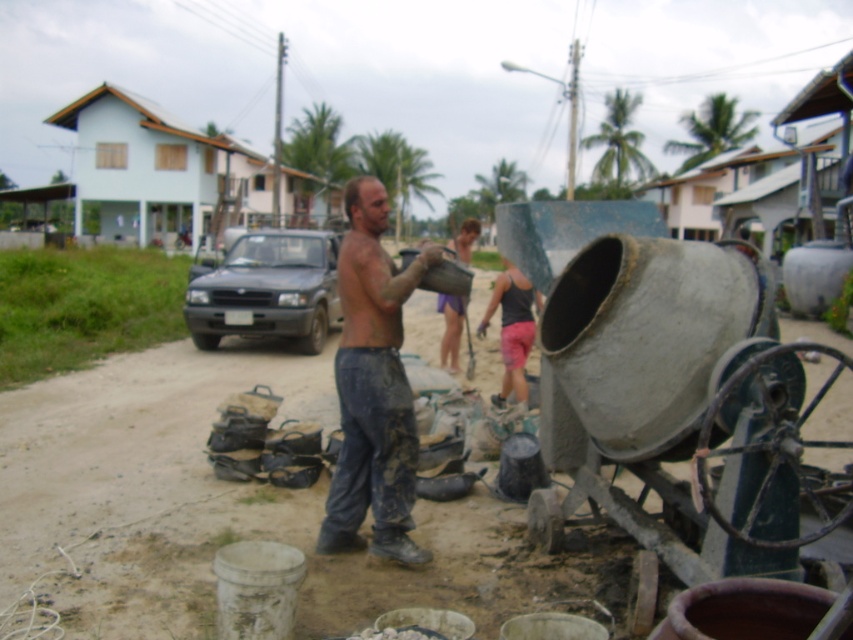
Question: Which object is the closest to the muddy pants at center?

Choices:
 (A) purple fabric shorts at center
 (B) dark gray matte truck at center-left
 (C) dark gray tank top at center

Answer: (A)

Question: Does muddy pants at center appear over purple fabric shorts at center?

Choices:
 (A) no
 (B) yes

Answer: (A)

Question: Is dark gray tank top at center bigger than purple fabric shorts at center?

Choices:
 (A) yes
 (B) no

Answer: (B)

Question: Does dark gray tank top at center have a larger size compared to purple fabric shorts at center?

Choices:
 (A) no
 (B) yes

Answer: (A)

Question: Which point is farther to the camera?

Choices:
 (A) muddy pants at center
 (B) dark gray tank top at center
 (C) dark gray matte truck at center-left
 (D) purple fabric shorts at center

Answer: (C)

Question: Which of the following is the closest to the observer?

Choices:
 (A) purple fabric shorts at center
 (B) dark gray matte truck at center-left
 (C) dark gray tank top at center

Answer: (A)